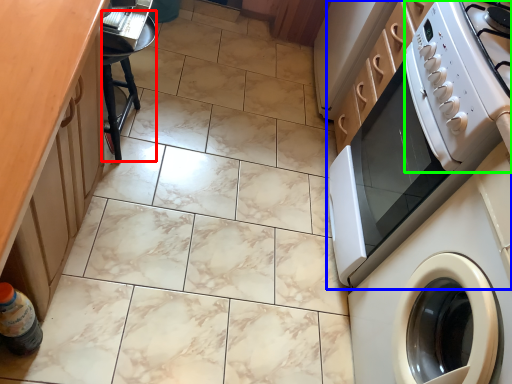
Question: Which object is positioned farthest from bar stool (highlighted by a red box)? Select from home appliance (highlighted by a blue box) and appliance (highlighted by a green box).

Choices:
 (A) home appliance
 (B) appliance

Answer: (B)